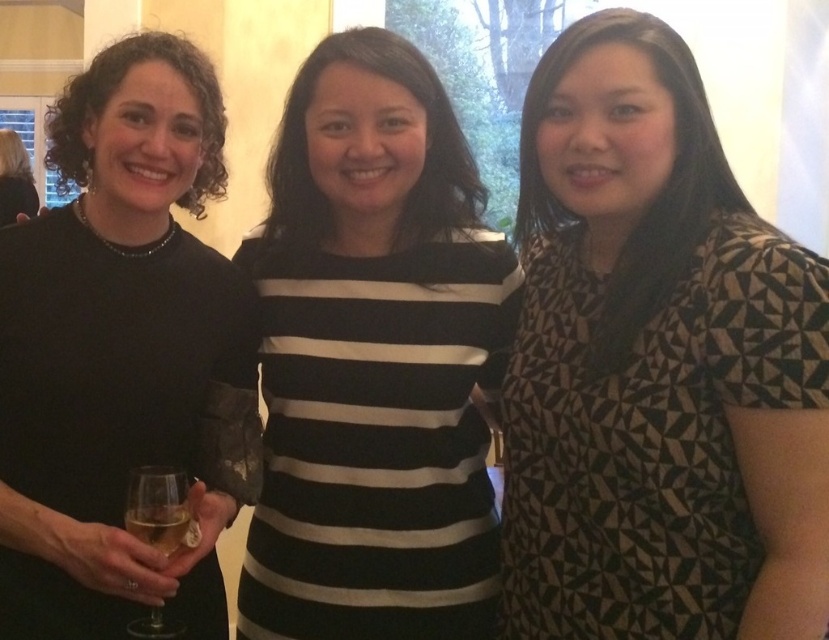
Question: Observing the image, what is the correct spatial positioning of black geometric-patterned dress at center in reference to black matte dress at left?

Choices:
 (A) above
 (B) below

Answer: (A)

Question: Is black matte dress at left to the right of clear glass wine glass at left from the viewer's perspective?

Choices:
 (A) no
 (B) yes

Answer: (A)

Question: Among these objects, which one is farthest from the camera?

Choices:
 (A) matte black dress at center
 (B) clear glass at lower left
 (C) black geometric-patterned dress at center
 (D) clear glass wine glass at left

Answer: (A)

Question: Is black geometric-patterned dress at center in front of black matte dress at left?

Choices:
 (A) no
 (B) yes

Answer: (B)

Question: Considering the real-world distances, which object is closest to the black striped shirt at center?

Choices:
 (A) matte black dress at center
 (B) clear glass wine glass at left
 (C) black matte dress at left

Answer: (C)

Question: Based on their relative distances, which object is farther from the clear glass wine glass at left?

Choices:
 (A) black striped shirt at center
 (B) black matte dress at left
 (C) clear glass at lower left

Answer: (A)